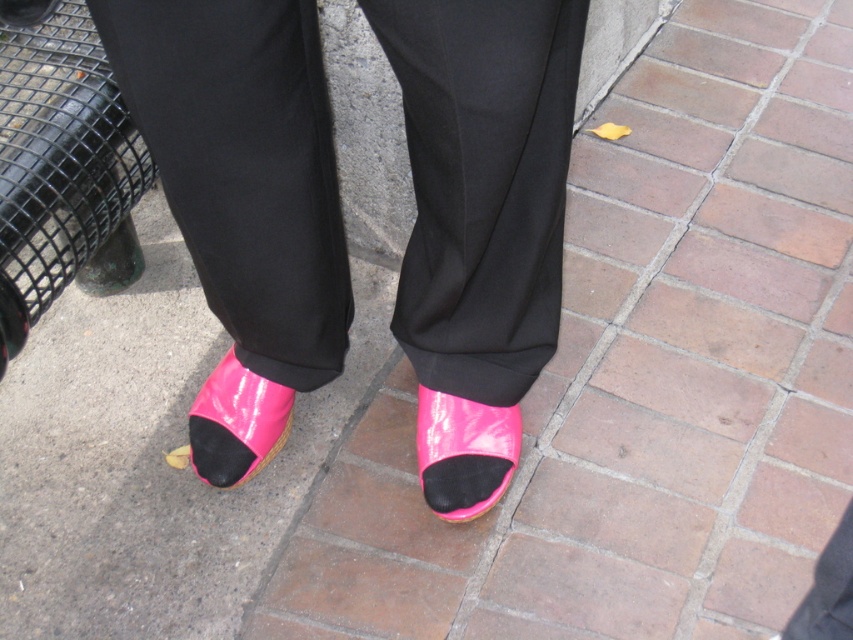
Question: Is pink glossy sandal at lower center positioned behind matte black heel at lower center?

Choices:
 (A) no
 (B) yes

Answer: (A)

Question: From the image, what is the correct spatial relationship of black smooth pants at center in relation to pink glossy shoe at lower center?

Choices:
 (A) below
 (B) above

Answer: (B)

Question: Which of the following is the farthest from the observer?

Choices:
 (A) pink glossy sandal at lower center
 (B) pink glossy shoe at lower center

Answer: (A)

Question: Which of the following is the farthest from the observer?

Choices:
 (A) (479, 499)
 (B) (184, 461)

Answer: (B)

Question: Which point is closer to the camera taking this photo?

Choices:
 (A) (235, 410)
 (B) (132, 76)

Answer: (B)

Question: Is black smooth pants at center positioned at the back of matte black heel at lower center?

Choices:
 (A) no
 (B) yes

Answer: (A)